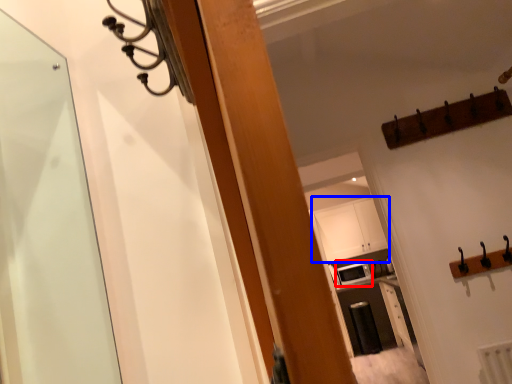
Question: Which object appears closest to the camera in this image, appliance (highlighted by a red box) or cabinetry (highlighted by a blue box)?

Choices:
 (A) appliance
 (B) cabinetry

Answer: (A)